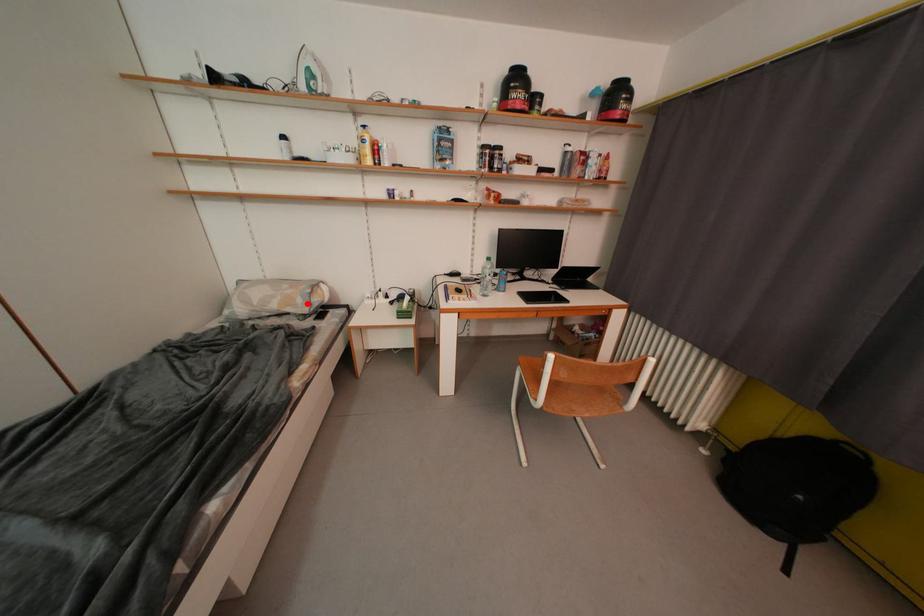
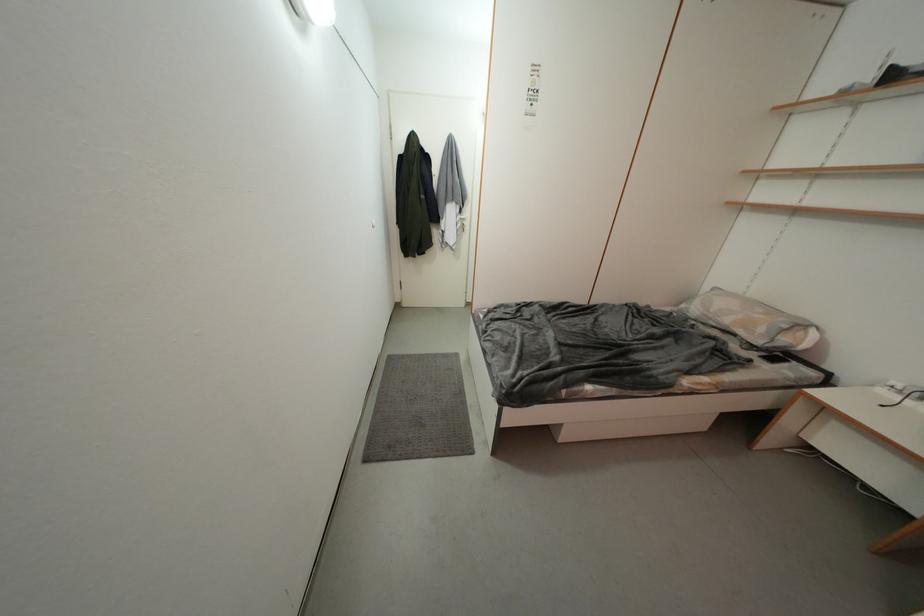
Locate, in the second image, the point that corresponds to the highlighted location in the first image.

(769, 333)